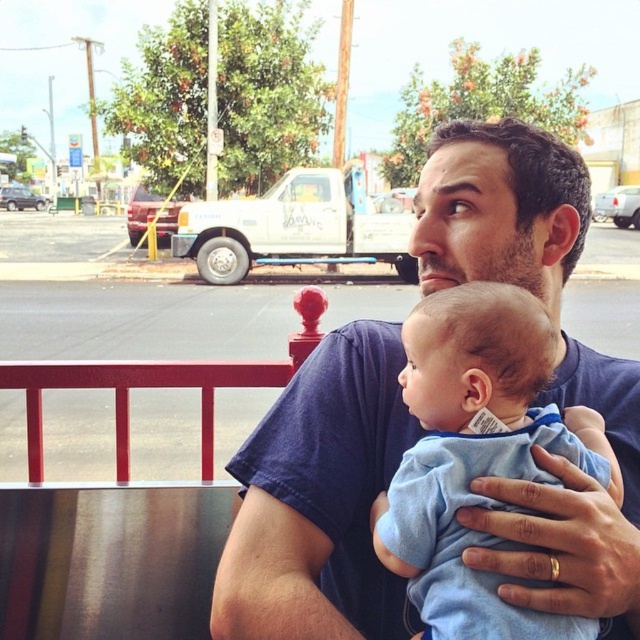
You are a photographer trying to capture a closeup of the blue cotton shirt at center and the blue soft fabric baby at center. Which object should you focus on first if you want to ensure both are in focus?

You should focus on the blue cotton shirt at center first because it is closer to the viewer than the blue soft fabric baby at center, so adjusting focus from the closer object to the farther one will help both be in focus.

You are a photographer trying to capture a closeup of the blue cotton shirt at center. Based on the scene description, where should you position your camera relative to the man and the baby?

The blue cotton shirt at center is located at point (320, 500), so the camera should be positioned slightly to the right and at the midpoint vertically to capture the closeup.

You are a photographer trying to capture a closeup shot of the baby. The baby is at point (554, 212) and the man is at point (410, 486). Which point should you focus on to ensure the baby is in focus?

You should focus on point (554, 212) because it is where the baby is located and it is closer to the camera than the man at point (410, 486).